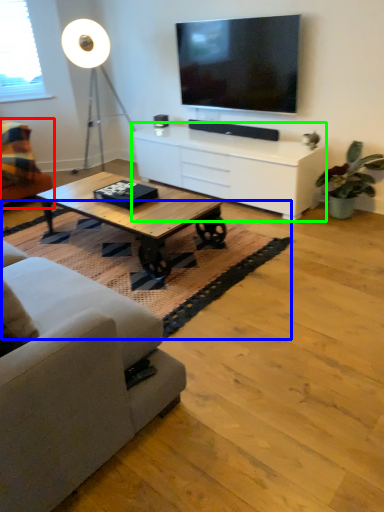
Question: Estimate the real-world distances between objects in this image. Which object is closer to studio couch (highlighted by a red box), mat (highlighted by a blue box) or cabinetry (highlighted by a green box)?

Choices:
 (A) mat
 (B) cabinetry

Answer: (A)